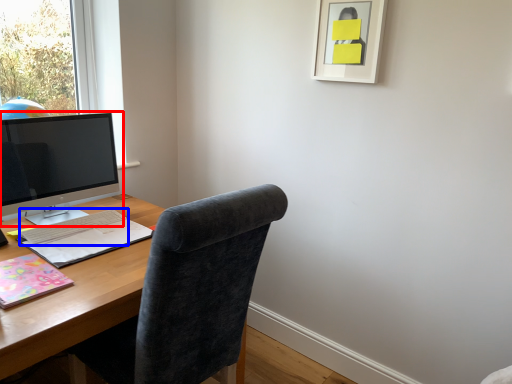
Question: Which object is further to the camera taking this photo, computer monitor (highlighted by a red box) or computer keyboard (highlighted by a blue box)?

Choices:
 (A) computer monitor
 (B) computer keyboard

Answer: (B)